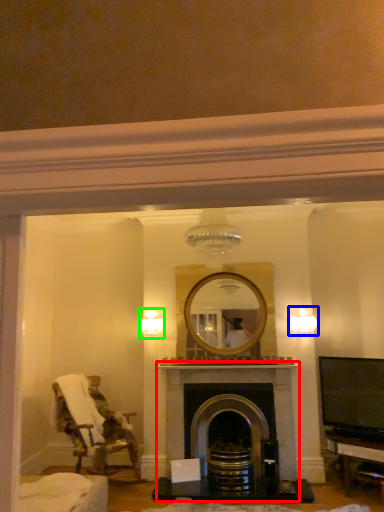
Question: Considering the real-world distances, which object is closest to fireplace (highlighted by a red box)? light fixture (highlighted by a blue box) or light fixture (highlighted by a green box).

Choices:
 (A) light fixture
 (B) light fixture

Answer: (A)